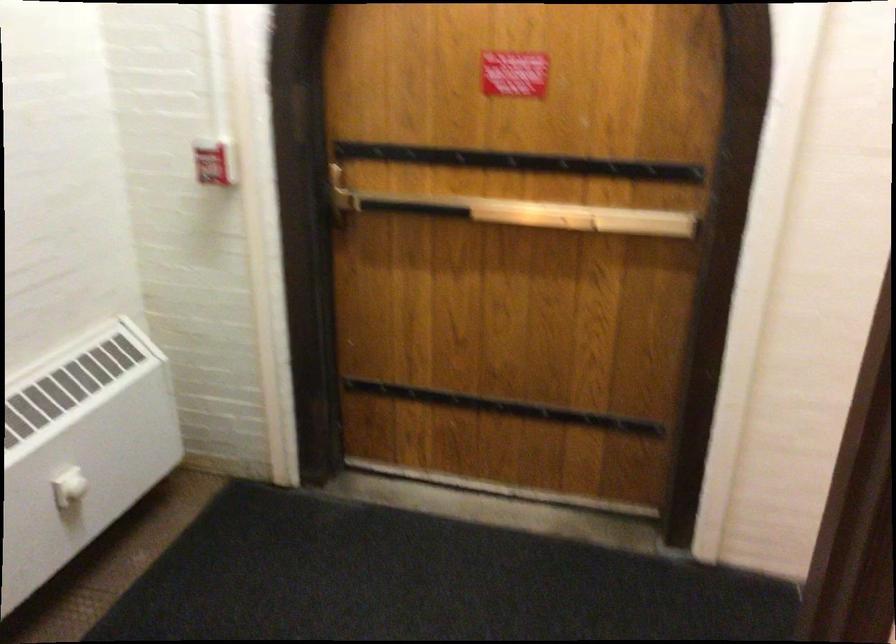
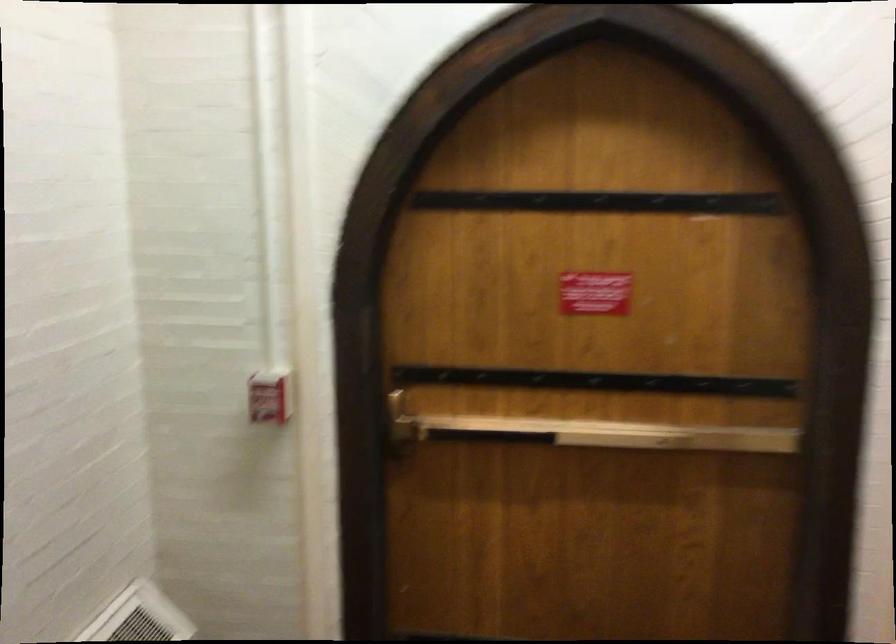
The images are taken continuously from a first-person perspective. In which direction are you moving?

The movement direction of the cameraman is left, forward.